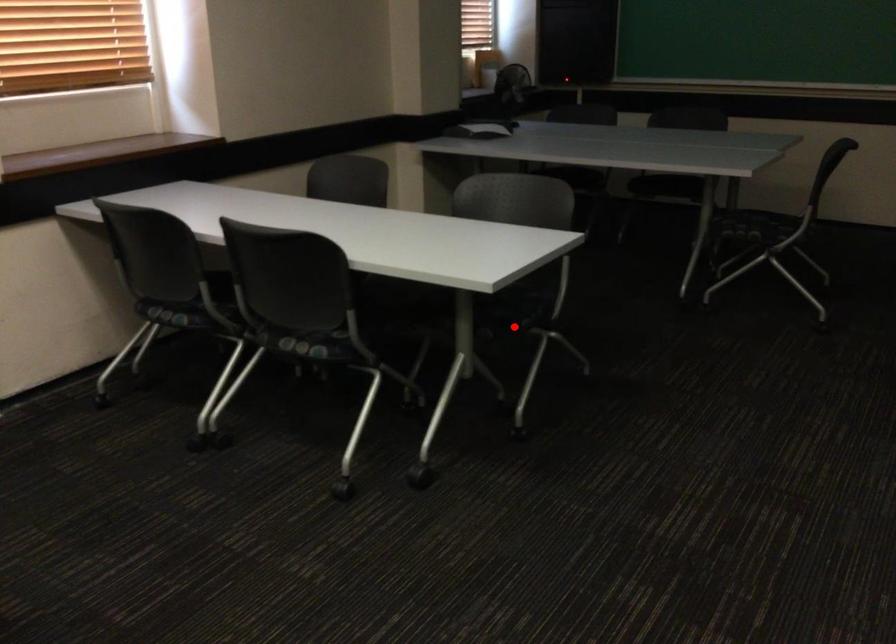
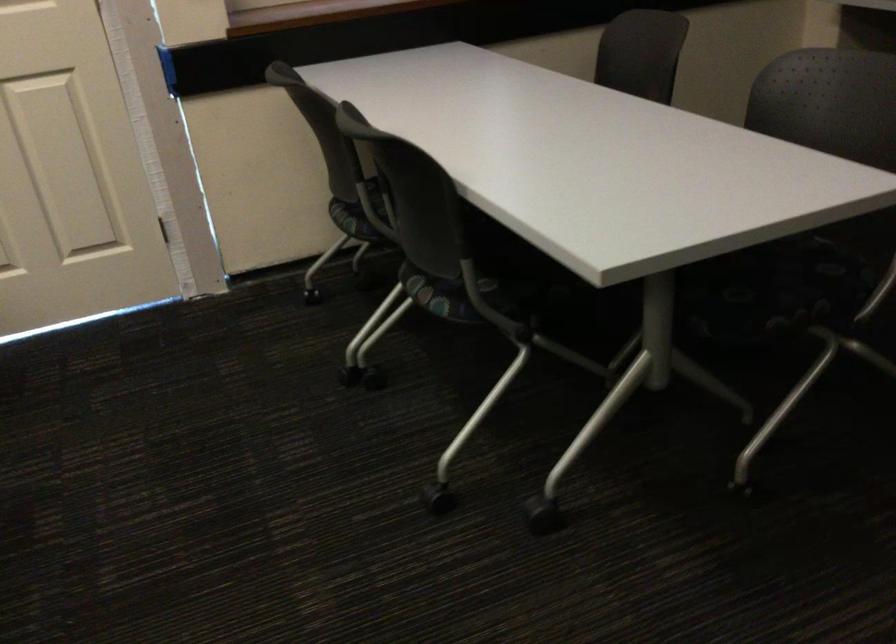
Find the pixel in the second image that matches the highlighted location in the first image.

(748, 326)